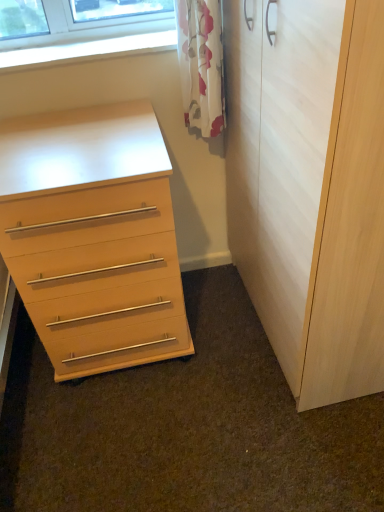
Where is `free space between light wood/finish chest of drawers at left and light wood/texture cupboard at right`? The height and width of the screenshot is (512, 384). free space between light wood/finish chest of drawers at left and light wood/texture cupboard at right is located at coordinates (206, 348).